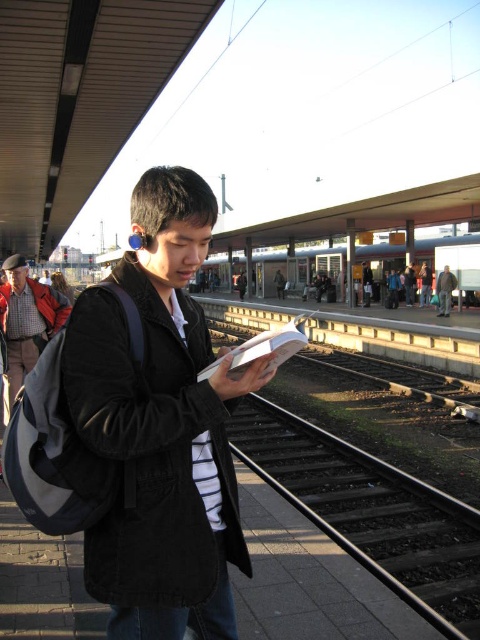
You are standing on the train station platform and want to know the exact location of the black metal train track at center. What are its coordinates?

The black metal train track at center is located at point (371, 513).

You are standing on the train platform and want to take a photo of both the black metal train track at center and the silver metallic train at center without moving. Which object should you focus on first to ensure both are in the frame?

You should focus on the black metal train track at center first since it is closer to you than the silver metallic train at center, so by focusing on it, the train further away will still be in focus.

You are standing on the train platform and want to walk from point (387,516) to point (444,292). Which direction should you move to get closer to the tracks?

To move from point (387,516) to point (444,292), you should move towards the tracks because point (387,516) is closer to the viewer than point (444,292), meaning it is farther from the tracks. Therefore, moving toward the tracks would bring you closer to point (444,292).